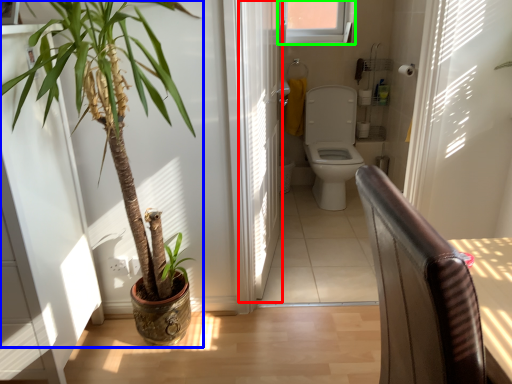
Question: Based on their relative distances, which object is farther from screen door (highlighted by a red box)? Choose from houseplant (highlighted by a blue box) and window (highlighted by a green box).

Choices:
 (A) houseplant
 (B) window

Answer: (B)